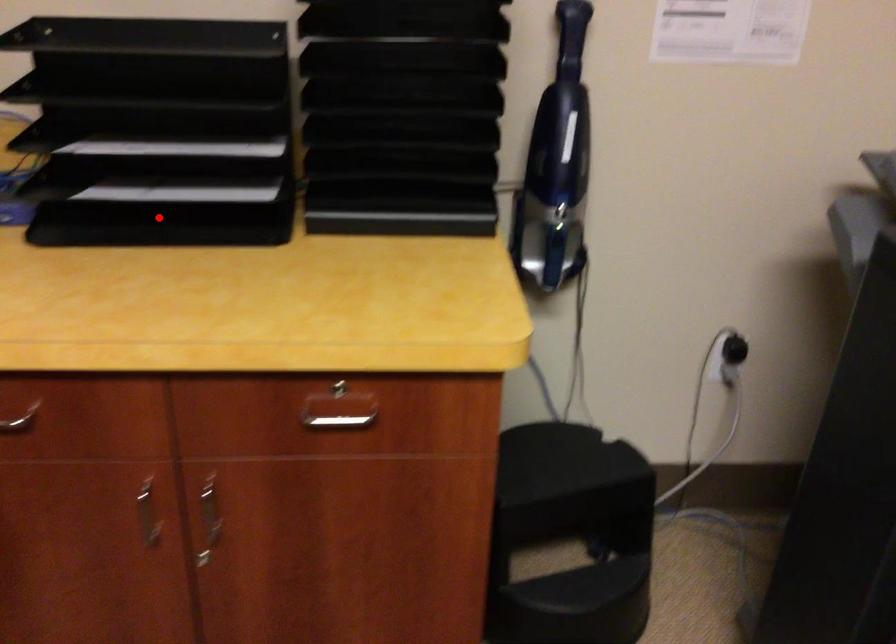
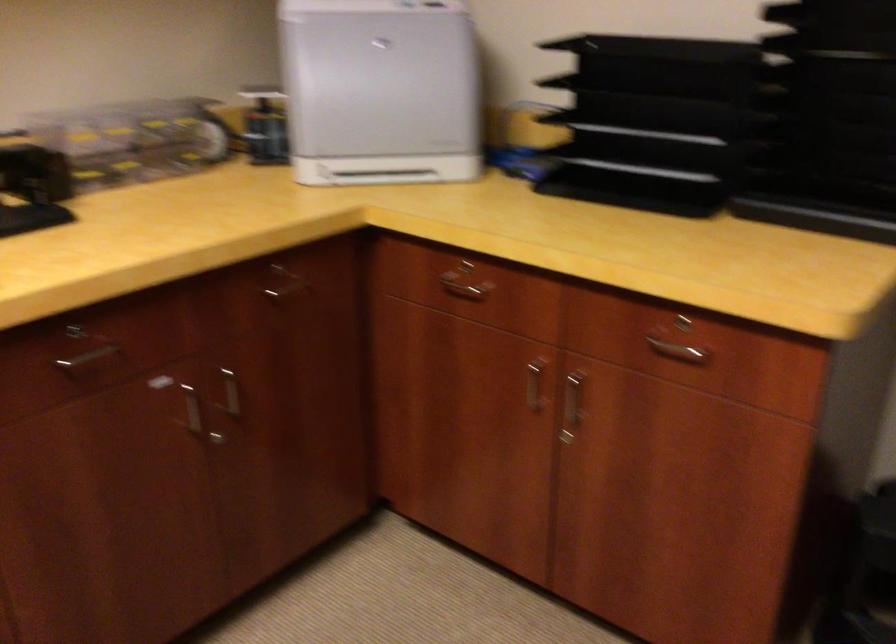
In the second image, find the point that corresponds to the highlighted location in the first image.

(632, 190)